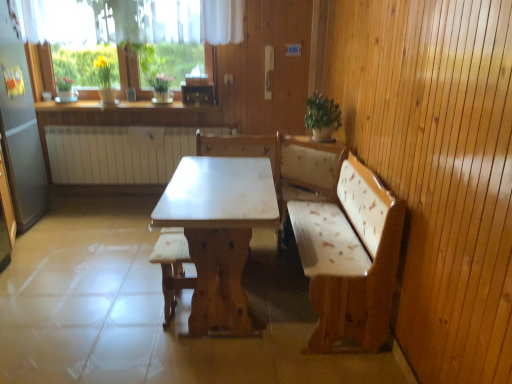
Question: Can you confirm if white glossy counter top at upper center is wider than light brown wood table at center?

Choices:
 (A) yes
 (B) no

Answer: (B)

Question: Is white glossy counter top at upper center facing towards light brown wood table at center?

Choices:
 (A) no
 (B) yes

Answer: (A)

Question: Considering the relative positions of white glossy counter top at upper center and light brown wood table at center in the image provided, is white glossy counter top at upper center behind light brown wood table at center?

Choices:
 (A) no
 (B) yes

Answer: (B)

Question: Is the position of white glossy counter top at upper center less distant than that of light brown wood table at center?

Choices:
 (A) yes
 (B) no

Answer: (B)

Question: Are white glossy counter top at upper center and light brown wood table at center beside each other?

Choices:
 (A) no
 (B) yes

Answer: (A)

Question: From the image's perspective, is green glossy vase at upper center, placed as the second plant when sorted from left to right, above or below white glossy counter top at upper center?

Choices:
 (A) below
 (B) above

Answer: (B)

Question: From their relative heights in the image, would you say green glossy vase at upper center, which is the 1th plant from right to left, is taller or shorter than white glossy counter top at upper center?

Choices:
 (A) short
 (B) tall

Answer: (B)

Question: Looking at their shapes, would you say green glossy vase at upper center, which is the 1th plant from right to left, is wider or thinner than white glossy counter top at upper center?

Choices:
 (A) wide
 (B) thin

Answer: (B)

Question: Is green glossy vase at upper center, which is the 1th plant from right to left, to the left or to the right of white glossy counter top at upper center in the image?

Choices:
 (A) left
 (B) right

Answer: (A)

Question: Looking at their shapes, would you say white glossy counter top at upper center is wider or thinner than green matte plant at upper left, arranged as the 2th plant when viewed from the right?

Choices:
 (A) wide
 (B) thin

Answer: (A)

Question: Do you think white glossy counter top at upper center is within green matte plant at upper left, which is the 1th plant from left to right, or outside of it?

Choices:
 (A) outside
 (B) inside

Answer: (A)

Question: From their relative heights in the image, would you say white glossy counter top at upper center is taller or shorter than green matte plant at upper left, which is the 1th plant from left to right?

Choices:
 (A) tall
 (B) short

Answer: (B)

Question: Is white glossy counter top at upper center bigger or smaller than green matte plant at upper left, arranged as the 2th plant when viewed from the right?

Choices:
 (A) big
 (B) small

Answer: (A)

Question: Is white fabric cushion at center spatially inside green leafy plant at upper center, or outside of it?

Choices:
 (A) inside
 (B) outside

Answer: (B)

Question: Is white fabric cushion at center to the left or to the right of green leafy plant at upper center in the image?

Choices:
 (A) left
 (B) right

Answer: (A)